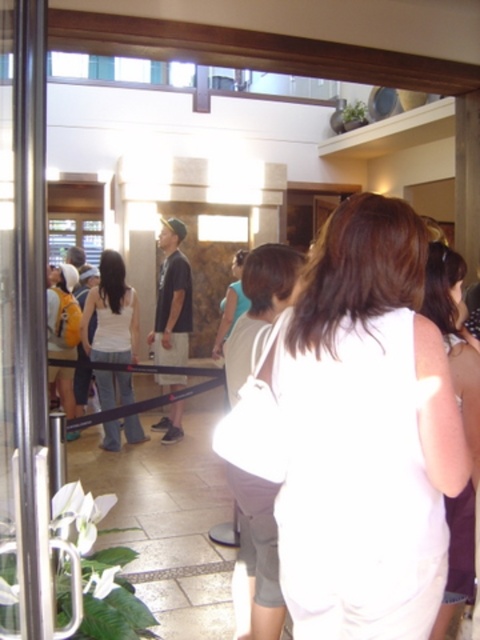
Question: Which object appears closest to the camera in this image?

Choices:
 (A) light gray fabric pants at center
 (B) white fabric shirt at center
 (C) transparent glass door at left
 (D) yellow backpack at left

Answer: (C)

Question: Which point appears closest to the camera in this image?

Choices:
 (A) (455, 609)
 (B) (56, 330)
 (C) (96, 340)
 (D) (299, 406)

Answer: (D)

Question: Can you confirm if white fabric dress at center is positioned below white fabric tank top at center?

Choices:
 (A) no
 (B) yes

Answer: (B)

Question: Does transparent glass door at left appear on the left side of white fabric tank top at center?

Choices:
 (A) yes
 (B) no

Answer: (B)

Question: Which object is the closest to the light gray fabric pants at center?

Choices:
 (A) white fabric tank top at center
 (B) white fabric shirt at center
 (C) white fabric dress at center
 (D) yellow backpack at left

Answer: (C)

Question: Is white fabric dress at center closer to camera compared to white fabric tank top at center?

Choices:
 (A) no
 (B) yes

Answer: (B)